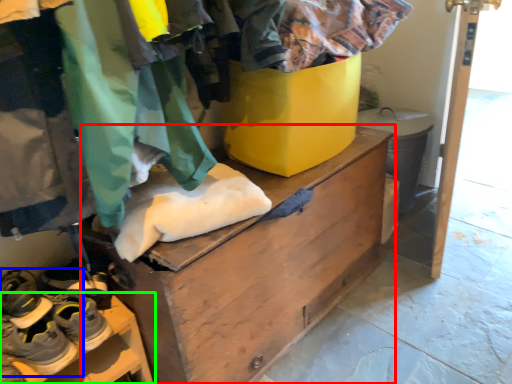
Question: Which object is positioned farthest from chest of drawers (highlighted by a red box)? Select from footwear (highlighted by a blue box) and furniture (highlighted by a green box).

Choices:
 (A) footwear
 (B) furniture

Answer: (A)